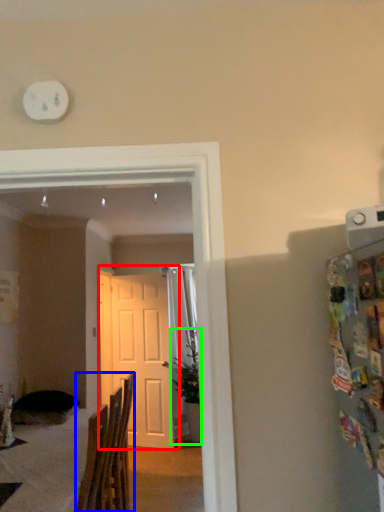
Question: Estimate the real-world distances between objects in this image. Which object is closer to door (highlighted by a red box), chair (highlighted by a blue box) or houseplant (highlighted by a green box)?

Choices:
 (A) chair
 (B) houseplant

Answer: (B)